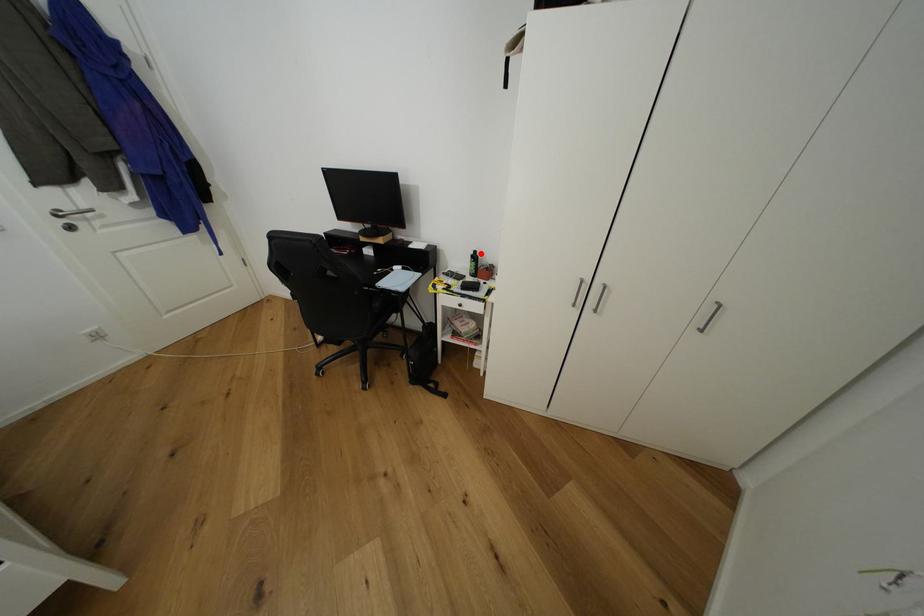
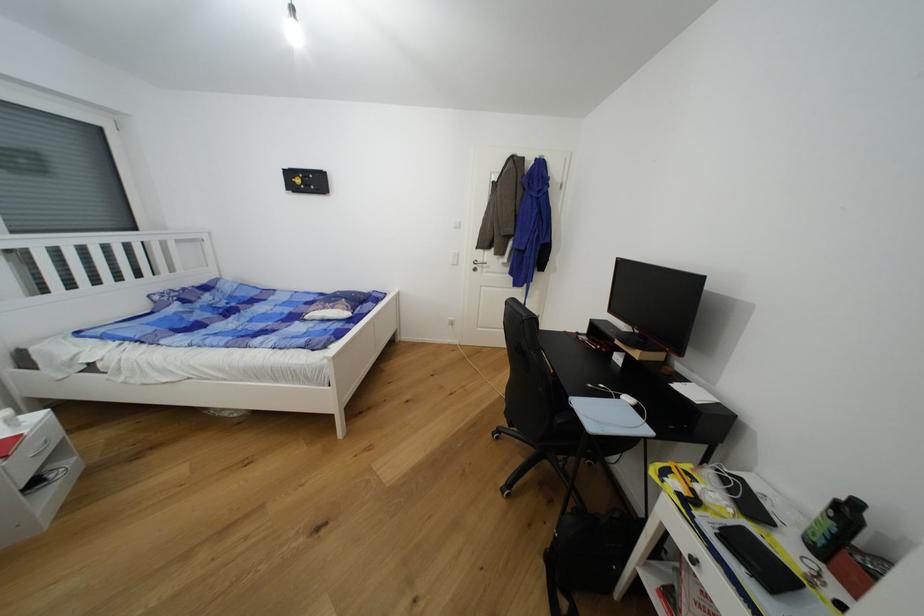
Find the pixel in the second image that matches the highlighted location in the first image.

(862, 506)